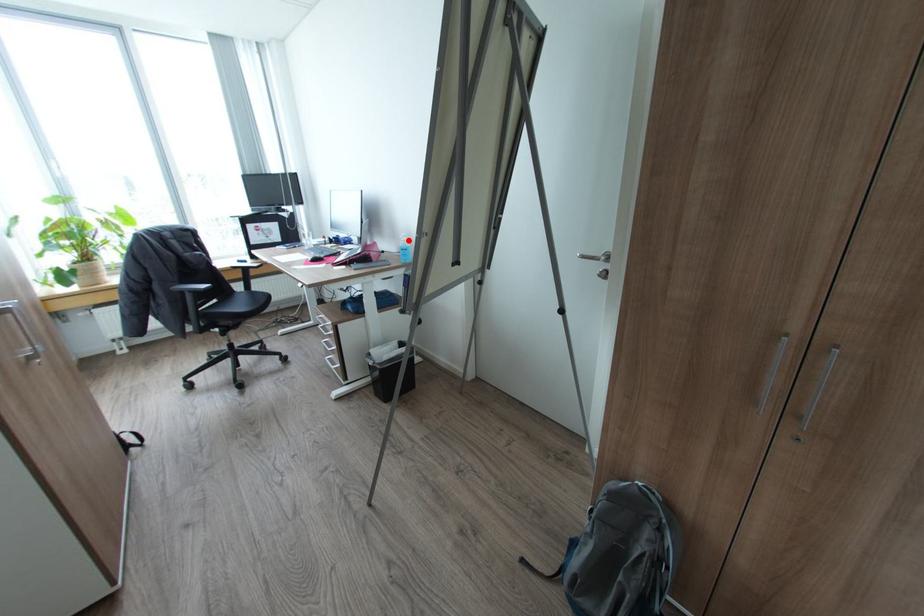
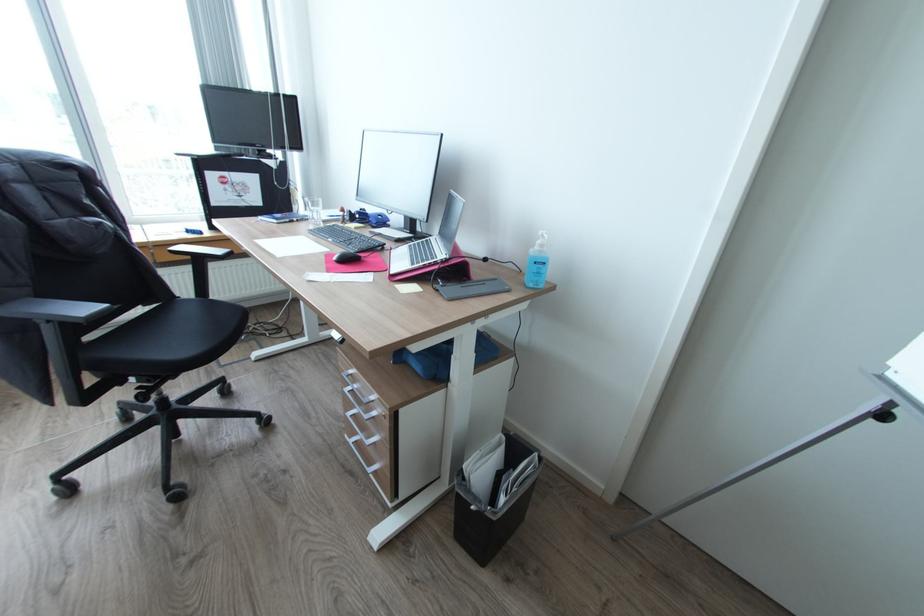
Locate, in the second image, the point that corresponds to the highlighted location in the first image.

(545, 245)